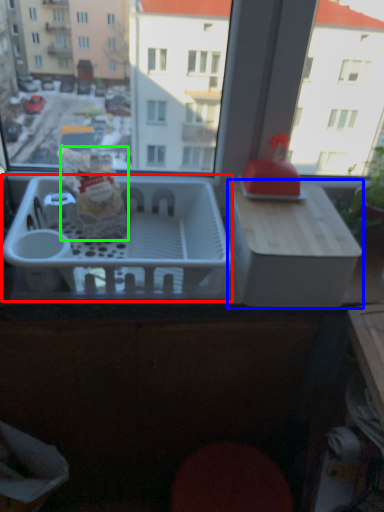
Question: Considering the real-world distances, which object is closest to basket (highlighted by a red box)? cardboard box (highlighted by a blue box) or snack (highlighted by a green box).

Choices:
 (A) cardboard box
 (B) snack

Answer: (B)